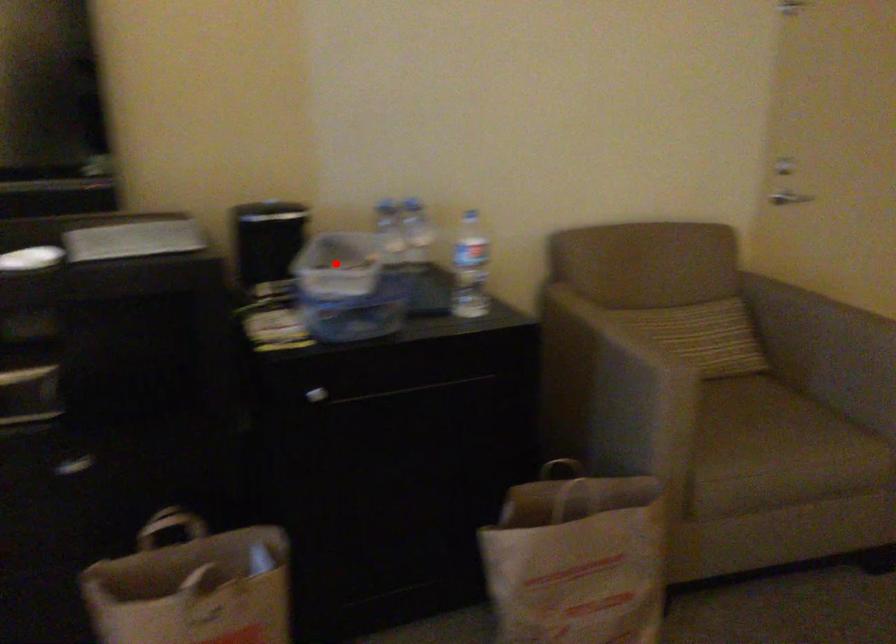
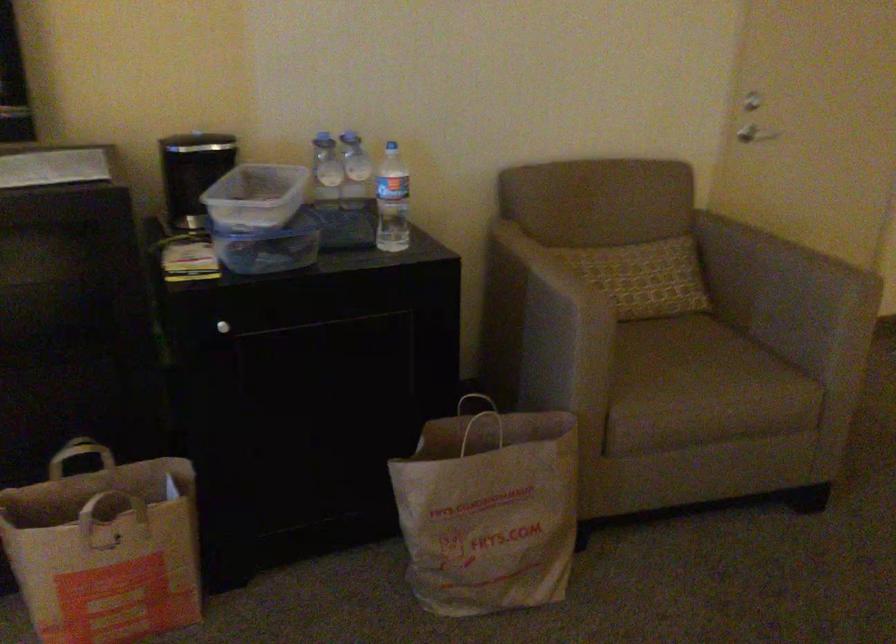
Locate, in the second image, the point that corresponds to the highlighted location in the first image.

(255, 196)